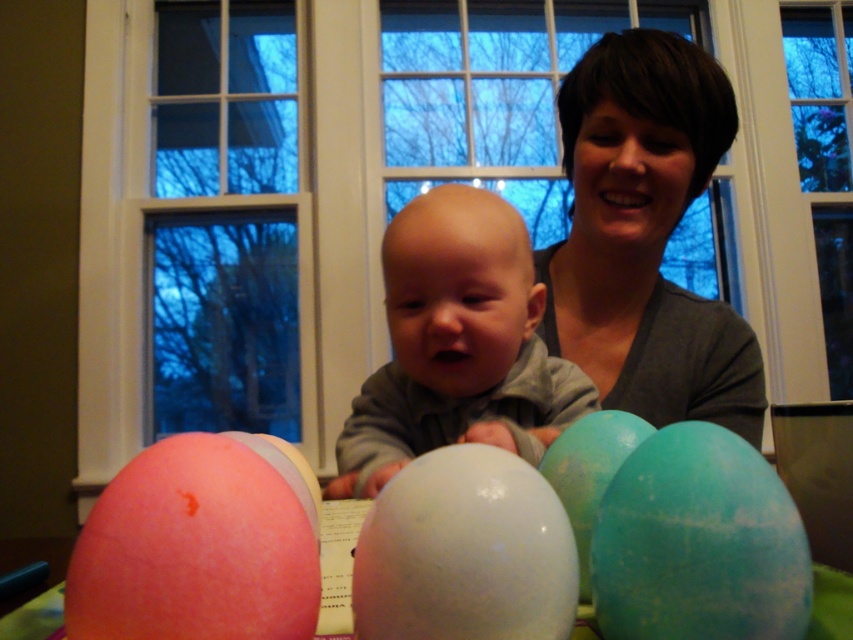
Which is more to the right, matte gray baby at center or matte pink balloon at lower left?

From the viewer's perspective, matte gray baby at center appears more on the right side.

Can you confirm if matte gray baby at center is positioned to the left of matte pink balloon at lower left?

In fact, matte gray baby at center is to the right of matte pink balloon at lower left.

Between point (428, 259) and point (102, 492), which one is positioned behind?

Positioned behind is point (102, 492).

What are the coordinates of `matte gray baby at center` in the screenshot? It's located at (457, 344).

Does matte gray baby at center have a greater height compared to white glossy balloon at center?

Indeed, matte gray baby at center has a greater height compared to white glossy balloon at center.

Who is positioned more to the right, matte gray baby at center or white glossy balloon at center?

matte gray baby at center

Does point (403, 244) come in front of point (421, 477)?

No, (403, 244) is behind (421, 477).

This screenshot has width=853, height=640. In order to click on matte gray baby at center in this screenshot , I will do `click(457, 344)`.

Does matte pink balloon at lower left appear under white glossy balloon at center?

Correct, matte pink balloon at lower left is located below white glossy balloon at center.

Can you confirm if matte pink balloon at lower left is positioned to the left of white glossy balloon at center?

Yes, matte pink balloon at lower left is to the left of white glossy balloon at center.

Measure the distance between point (142, 552) and camera.

They are 33.16 centimeters apart.

Locate an element on the screen. This screenshot has height=640, width=853. matte pink balloon at lower left is located at coordinates (200, 545).